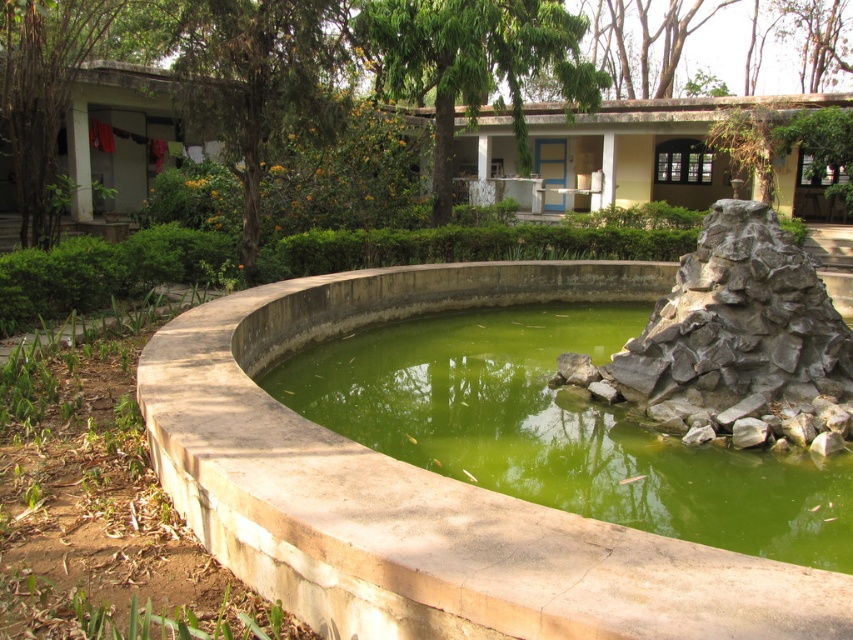
Question: Which of the following is the farthest from the observer?

Choices:
 (A) gray rock formation at right
 (B) green concrete pond at center

Answer: (B)

Question: Does green concrete pond at center appear under gray rock formation at right?

Choices:
 (A) no
 (B) yes

Answer: (B)

Question: Is green concrete pond at center further to camera compared to gray rock formation at right?

Choices:
 (A) no
 (B) yes

Answer: (B)

Question: Is green concrete pond at center further to the viewer compared to gray rock formation at right?

Choices:
 (A) yes
 (B) no

Answer: (A)

Question: Which point is farther from the camera taking this photo?

Choices:
 (A) (672, 323)
 (B) (556, 497)

Answer: (A)